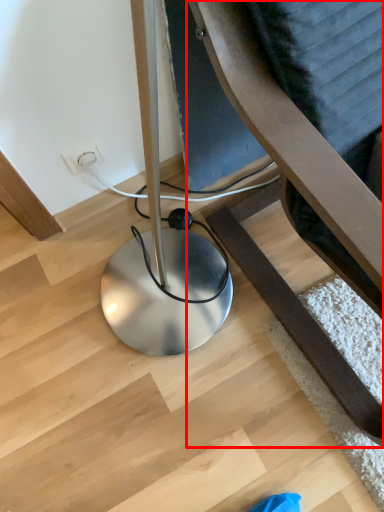
Question: Considering the relative positions of furniture (annotated by the red box) and electric outlet in the image provided, where is furniture (annotated by the red box) located with respect to the staircase?

Choices:
 (A) right
 (B) left

Answer: (A)